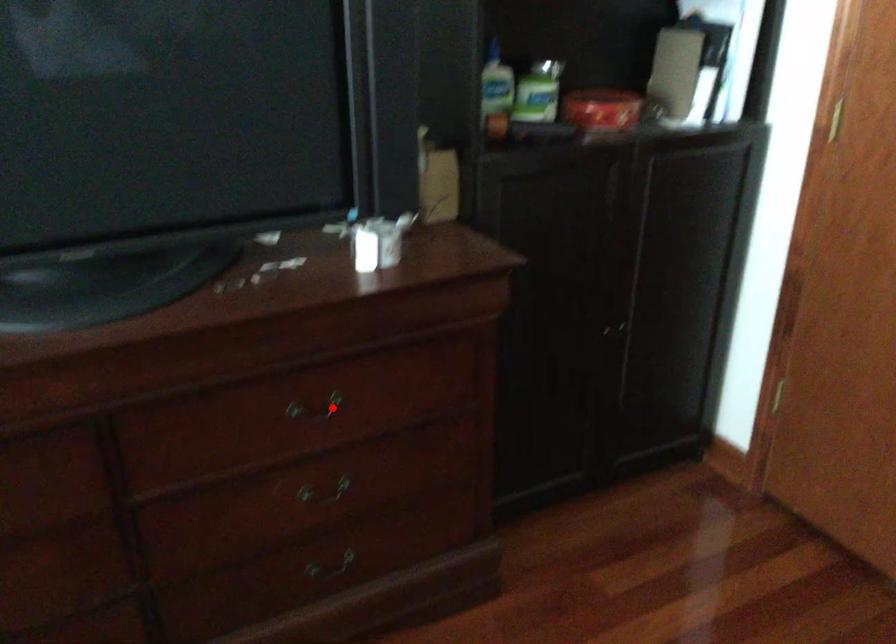
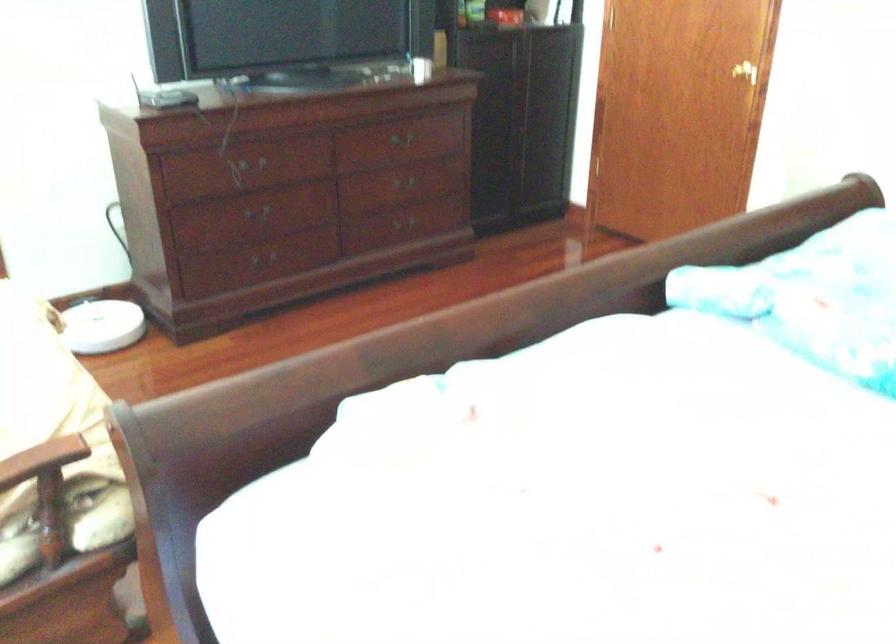
Where in the second image is the point corresponding to the highlighted location from the first image?

(401, 138)